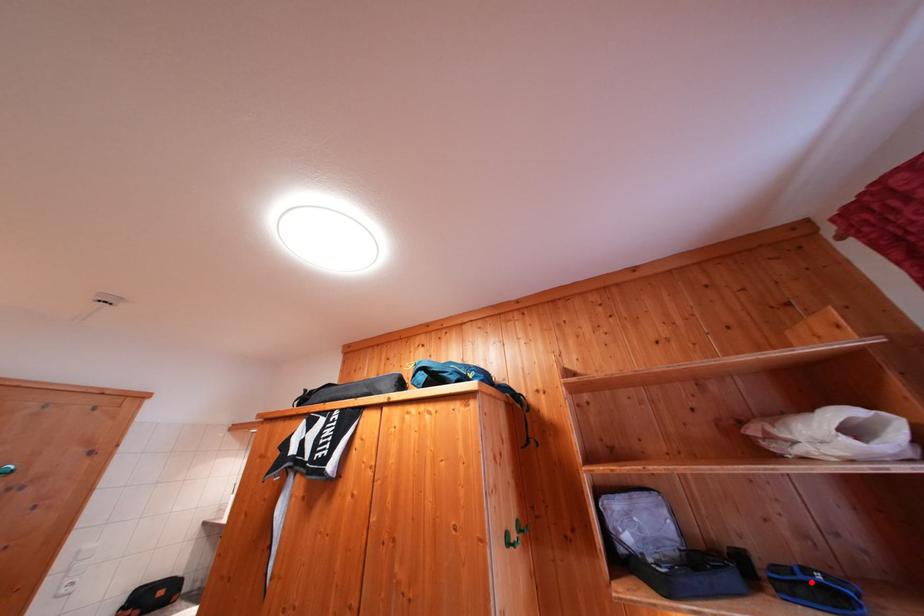
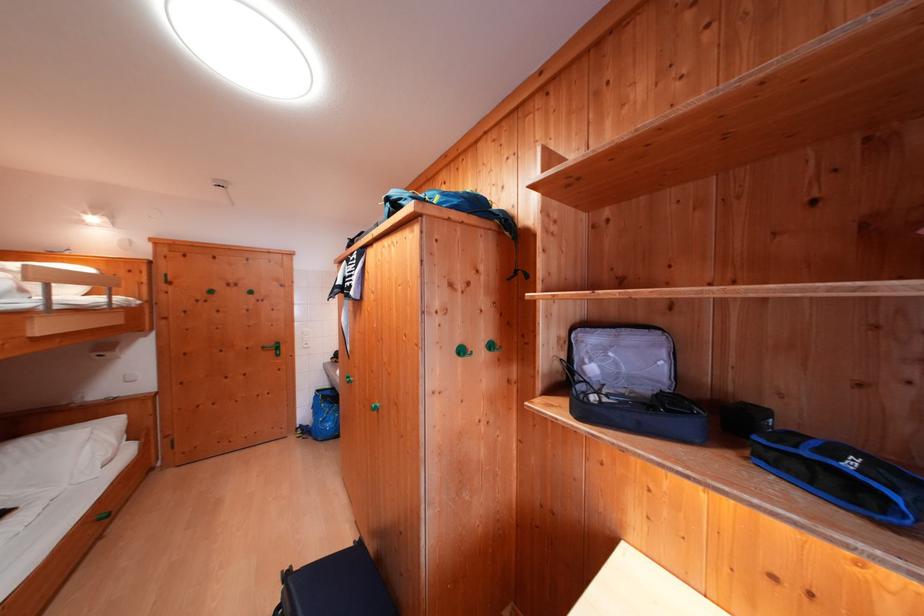
Find the pixel in the second image that matches the highlighted location in the first image.

(815, 456)